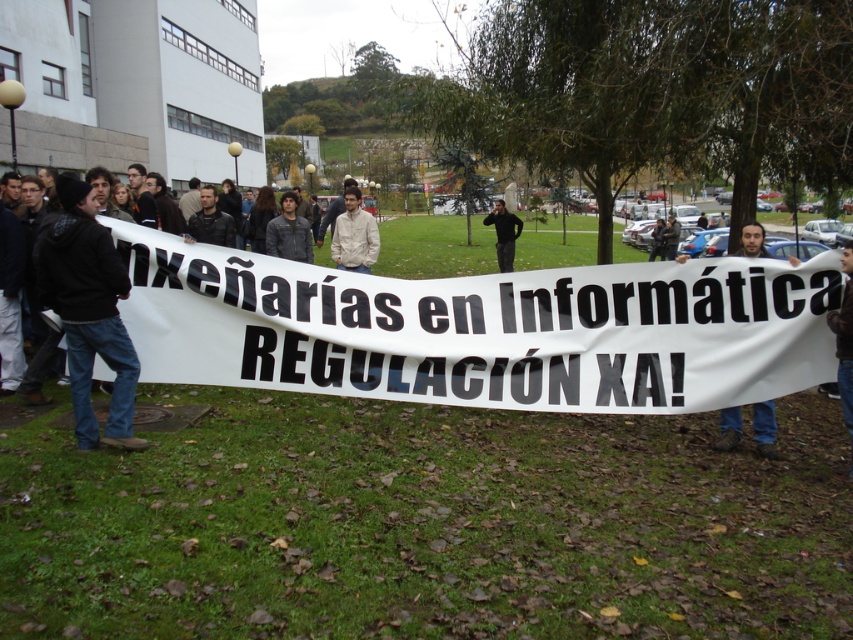
In the scene shown: You are a photographer at the protest scene. You need to capture a clear photo of the beige fabric shirt at center and the black fabric at center. Based on their positions, which one is closer to the bottom of the image?

The beige fabric shirt at center is positioned under the black fabric at center, so it is closer to the bottom of the image.

You are standing at the point closest to the bottom left corner of the image. There are two points marked in the scene, one at point (49, 256) and another at point (775, 451). If you want to walk towards the point that is farther away from you, which coordinate should you head towards?

You should head towards point (775, 451) because it is farther away from your current position at the bottom left corner of the image compared to point (49, 256).